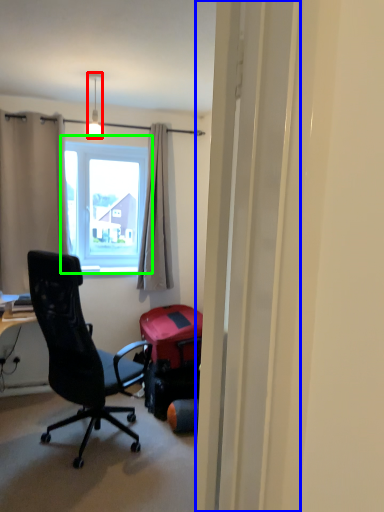
Question: Considering the real-world distances, which object is closest to lamp (highlighted by a red box)? screen door (highlighted by a blue box) or window (highlighted by a green box).

Choices:
 (A) screen door
 (B) window

Answer: (B)